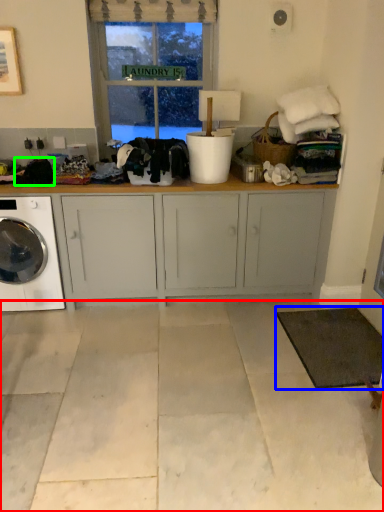
Question: Which object is positioned farthest from concrete (highlighted by a red box)? Select from mat (highlighted by a blue box) and clothing (highlighted by a green box).

Choices:
 (A) mat
 (B) clothing

Answer: (B)